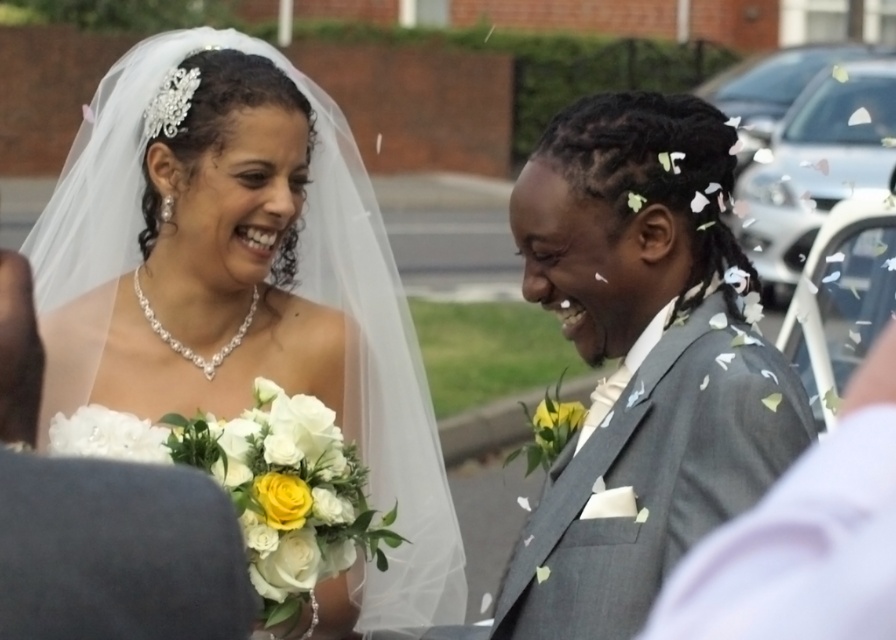
You are a photographer at the wedding and want to capture a photo where both the white satin veil at upper left and the gray textured suit at right are in the frame. Based on their positions, which side of the frame should the veil be placed on?

The white satin veil at upper left is to the left of the gray textured suit at right, so the veil should be positioned on the left side of the frame to include both elements.

You are a photographer at the wedding and want to capture a closeup shot of the white satin veil at upper left and the gray textured suit at right. Which one should you zoom in on first to ensure both are in frame?

The white satin veil at upper left is larger in width than the gray textured suit at right, so you should zoom in on the white satin veil at upper left first to ensure both fit in the frame.

You are a photographer at the wedding and want to capture a closeup of the white satin veil at upper left and the gray textured suit at right. Which object will appear bigger in the photo?

The white satin veil at upper left will appear bigger in the photo because it has a larger size compared to the gray textured suit at right.